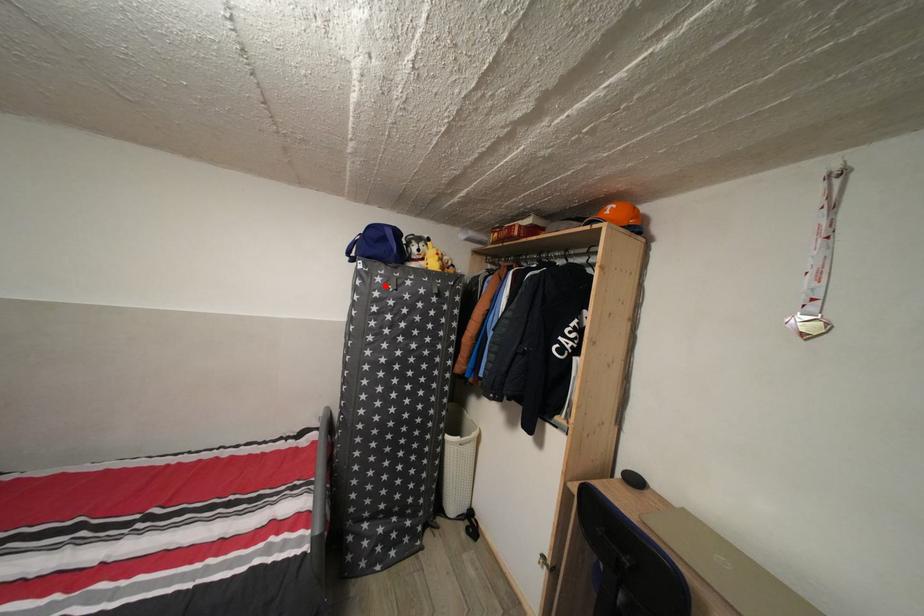
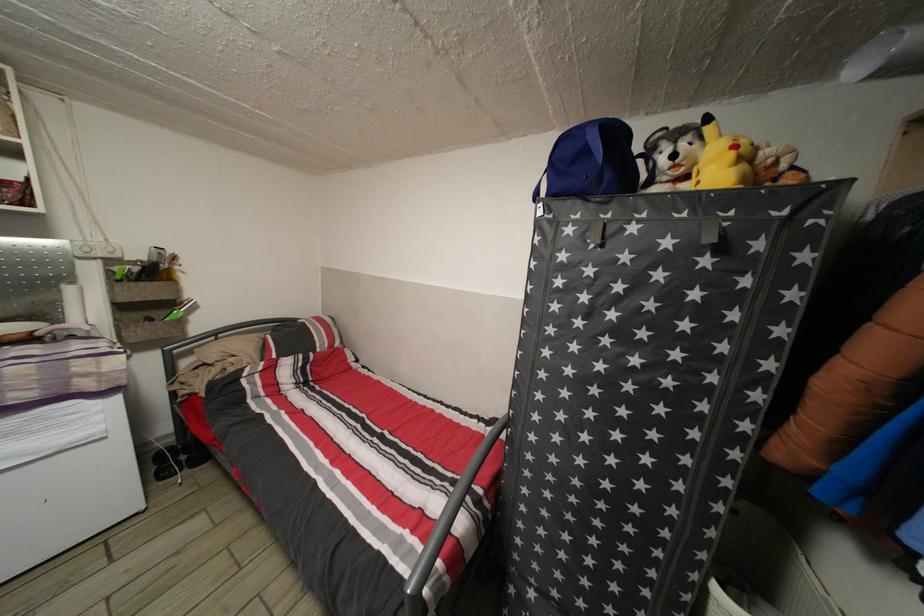
Locate, in the second image, the point that corresponds to the highlighted location in the first image.

(576, 237)